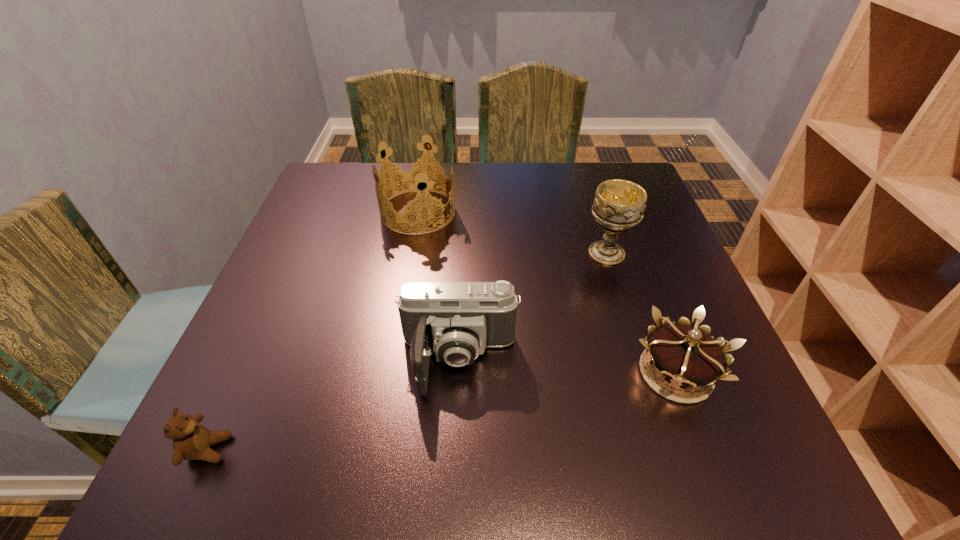
Where is `vacant space that satisfies the following two spatial constraints: 1. on the front side of the right crown; 2. at the face of the nearest object`? The image size is (960, 540). vacant space that satisfies the following two spatial constraints: 1. on the front side of the right crown; 2. at the face of the nearest object is located at coordinates (704, 449).

At what (x,y) coordinates should I click in order to perform the action: click on vacant space that satisfies the following two spatial constraints: 1. on the front side of the farthest object; 2. at the face of the shortest object. Please return your answer as a coordinate pair (x, y). The image size is (960, 540). Looking at the image, I should click on (377, 449).